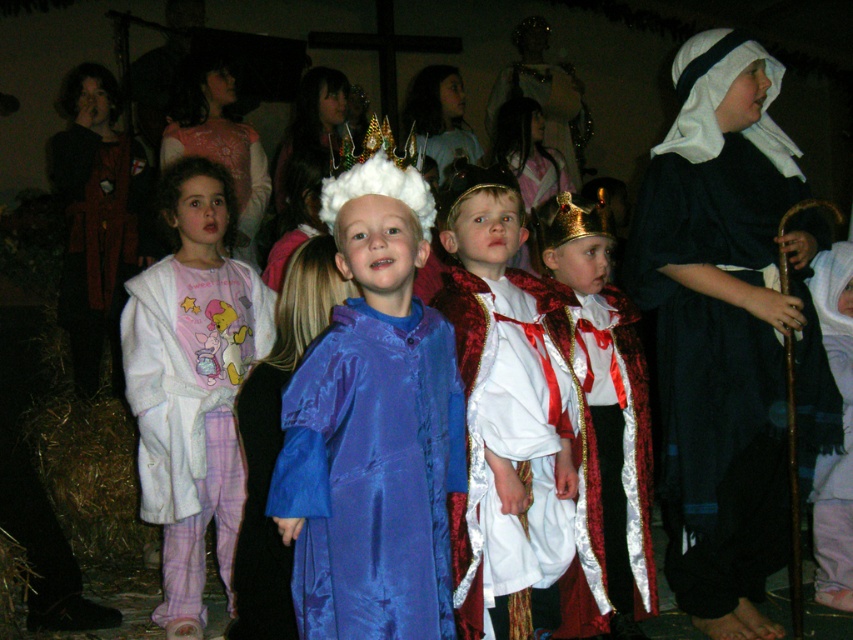
Question: From the image, what is the correct spatial relationship of satin blue robe at center in relation to shiny red velvet robe at center?

Choices:
 (A) above
 (B) below

Answer: (A)

Question: Which object is the farthest from the silky blue robe at center?

Choices:
 (A) white fluffy blanket at lower right
 (B) white cloth headscarf at upper right
 (C) gold glittering crown at center
 (D) white fluffy crown at center

Answer: (A)

Question: Can you confirm if satin blue robe at center is positioned to the right of white fluffy crown at center?

Choices:
 (A) yes
 (B) no

Answer: (A)

Question: Estimate the real-world distances between objects in this image. Which object is closer to the white fluffy crown at center?

Choices:
 (A) gold glittering crown at center
 (B) white cloth headscarf at upper right
 (C) shiny red velvet robe at center

Answer: (A)

Question: Among these points, which one is farthest from the camera?

Choices:
 (A) (395, 353)
 (B) (202, 481)

Answer: (B)

Question: Is satin blue robe at center to the right of white fluffy blanket at lower right from the viewer's perspective?

Choices:
 (A) yes
 (B) no

Answer: (B)